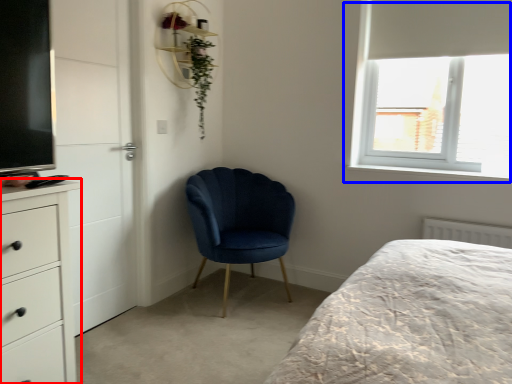
Question: Among these objects, which one is nearest to the camera, chest of drawers (highlighted by a red box) or window (highlighted by a blue box)?

Choices:
 (A) chest of drawers
 (B) window

Answer: (A)